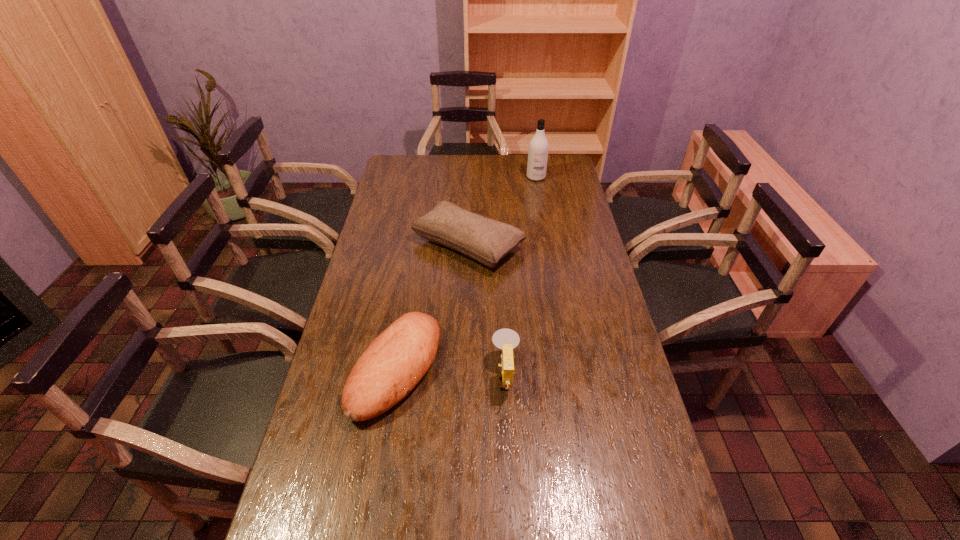
Identify the location of vacant area situated on the front of the bread. (370, 529).

Where is `object that is at the far edge`? This screenshot has height=540, width=960. object that is at the far edge is located at coordinates (538, 147).

Image resolution: width=960 pixels, height=540 pixels. I want to click on object that is at the left edge, so click(394, 363).

You are a GUI agent. You are given a task and a screenshot of the screen. Output one action in this format:
    pyautogui.click(x=<x>, y=<y>)
    Task: Click on the object present at the right edge
    The height and width of the screenshot is (540, 960).
    Given the screenshot: What is the action you would take?
    pyautogui.click(x=538, y=147)

Locate an element on the screen. This screenshot has height=540, width=960. object that is positioned at the far right corner is located at coordinates coord(538,147).

You are a GUI agent. You are given a task and a screenshot of the screen. Output one action in this format:
    pyautogui.click(x=<x>, y=<y>)
    Task: Click on the vacant space at the far edge
    The height and width of the screenshot is (540, 960).
    Given the screenshot: What is the action you would take?
    pyautogui.click(x=464, y=169)

You are a GUI agent. You are given a task and a screenshot of the screen. Output one action in this format:
    pyautogui.click(x=<x>, y=<y>)
    Task: Click on the free space at the left edge
    
    Given the screenshot: What is the action you would take?
    pyautogui.click(x=326, y=381)

The height and width of the screenshot is (540, 960). In the image, there is a desktop. What are the coordinates of `vacant space at the right edge` in the screenshot? It's located at (630, 377).

Identify the location of free spot between the sponge and the shortest object. (451, 372).

This screenshot has height=540, width=960. Find the location of `free spot between the sponge and the third nearest object`. free spot between the sponge and the third nearest object is located at coordinates (487, 310).